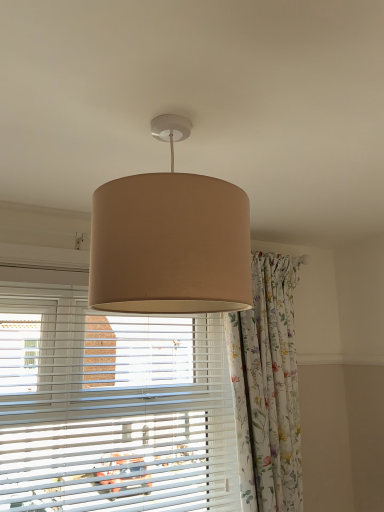
What is the approximate width of floral fabric curtain at center?

18.81 centimeters.

What do you see at coordinates (267, 388) in the screenshot? I see `floral fabric curtain at center` at bounding box center [267, 388].

Describe the element at coordinates (110, 404) in the screenshot. I see `white plastic blinds at center` at that location.

What are the coordinates of `floral fabric curtain at center` in the screenshot? It's located at (267, 388).

Is beige fabric lampshade at center not inside floral fabric curtain at center?

Yes, beige fabric lampshade at center is located beyond the bounds of floral fabric curtain at center.

From a real-world perspective, relative to floral fabric curtain at center, is beige fabric lampshade at center vertically above or below?

In terms of real-world spatial position, beige fabric lampshade at center is above floral fabric curtain at center.

Does white plastic blinds at center have a greater height compared to floral fabric curtain at center?

No, white plastic blinds at center is not taller than floral fabric curtain at center.

Relative to floral fabric curtain at center, is white plastic blinds at center in front or behind?

white plastic blinds at center is positioned closer to the viewer than floral fabric curtain at center.

Considering the relative positions of white plastic blinds at center and floral fabric curtain at center in the image provided, is white plastic blinds at center to the left of floral fabric curtain at center from the viewer's perspective?

Yes, white plastic blinds at center is to the left of floral fabric curtain at center.

Between floral fabric curtain at center and white plastic blinds at center, which one has more height?

With more height is floral fabric curtain at center.

Do you think floral fabric curtain at center is within white plastic blinds at center, or outside of it?

floral fabric curtain at center cannot be found inside white plastic blinds at center.

Is floral fabric curtain at center closer to camera compared to white plastic blinds at center?

No, the depth of floral fabric curtain at center is greater than that of white plastic blinds at center.

Is floral fabric curtain at center facing away from white plastic blinds at center?

No.

From the image's perspective, which is above, white plastic blinds at center or beige fabric lampshade at center?

beige fabric lampshade at center.

Identify the location of lamp lying on the right of white plastic blinds at center. (x=170, y=240).

From their relative heights in the image, would you say white plastic blinds at center is taller or shorter than beige fabric lampshade at center?

In the image, white plastic blinds at center appears to be taller than beige fabric lampshade at center.

Which of these two, beige fabric lampshade at center or white plastic blinds at center, is smaller?

With smaller size is beige fabric lampshade at center.

From the image's perspective, between beige fabric lampshade at center and white plastic blinds at center, who is located below?

white plastic blinds at center appears lower in the image.

Is beige fabric lampshade at center oriented away from white plastic blinds at center?

Correct, beige fabric lampshade at center is looking away from white plastic blinds at center.

From a real-world perspective, is floral fabric curtain at center physically above beige fabric lampshade at center?

No, from a real-world perspective, floral fabric curtain at center is not above beige fabric lampshade at center.

Is floral fabric curtain at center in front of or behind beige fabric lampshade at center in the image?

floral fabric curtain at center is behind beige fabric lampshade at center.

Is beige fabric lampshade at center located within floral fabric curtain at center?

No, floral fabric curtain at center does not contain beige fabric lampshade at center.

Where is `lamp in front of the floral fabric curtain at center`? lamp in front of the floral fabric curtain at center is located at coordinates (170, 240).

Image resolution: width=384 pixels, height=512 pixels. In order to click on curtain that appears on the right of white plastic blinds at center in this screenshot , I will do `click(267, 388)`.

Based on the photo, looking at the image, which one is located further to white plastic blinds at center, floral fabric curtain at center or beige fabric lampshade at center?

Based on the image, beige fabric lampshade at center appears to be further to white plastic blinds at center.

Looking at this image, looking at the image, which one is located further to beige fabric lampshade at center, white plastic blinds at center or floral fabric curtain at center?

Based on the image, floral fabric curtain at center appears to be further to beige fabric lampshade at center.

Looking at the image, which one is located closer to beige fabric lampshade at center, floral fabric curtain at center or white plastic blinds at center?

The object closer to beige fabric lampshade at center is white plastic blinds at center.

Which object lies further to the anchor point floral fabric curtain at center, beige fabric lampshade at center or white plastic blinds at center?

Among the two, beige fabric lampshade at center is located further to floral fabric curtain at center.

Considering their positions, is beige fabric lampshade at center positioned closer to white plastic blinds at center than floral fabric curtain at center?

floral fabric curtain at center is positioned closer to the anchor white plastic blinds at center.

When comparing their distances from floral fabric curtain at center, does white plastic blinds at center or beige fabric lampshade at center seem closer?

white plastic blinds at center is positioned closer to the anchor floral fabric curtain at center.

This screenshot has height=512, width=384. I want to click on window blind located between beige fabric lampshade at center and floral fabric curtain at center in the depth direction, so click(x=110, y=404).